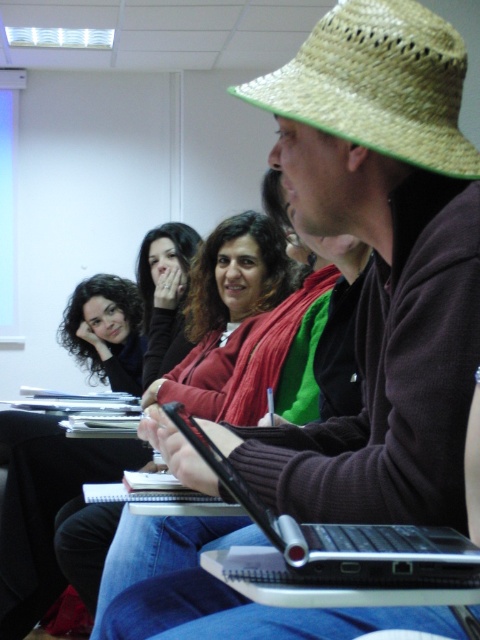
Question: Does matte red sweater at center lie in front of matte black hair at upper center?

Choices:
 (A) yes
 (B) no

Answer: (A)

Question: Which of the following is the farthest from the observer?

Choices:
 (A) black matte hair at center
 (B) black plastic laptop at center
 (C) matte red sweater at center
 (D) matte black hair at upper center

Answer: (A)

Question: Among these objects, which one is farthest from the camera?

Choices:
 (A) strawhat at upper right
 (B) black plastic laptop at center
 (C) matte black hair at upper center

Answer: (C)

Question: Is strawhat at upper right wider than black plastic laptop at center?

Choices:
 (A) yes
 (B) no

Answer: (B)

Question: Is strawhat at upper right thinner than matte black hair at upper center?

Choices:
 (A) no
 (B) yes

Answer: (B)

Question: Which object is the closest to the strawhat at upper right?

Choices:
 (A) black matte hair at center
 (B) matte black hair at upper center

Answer: (B)